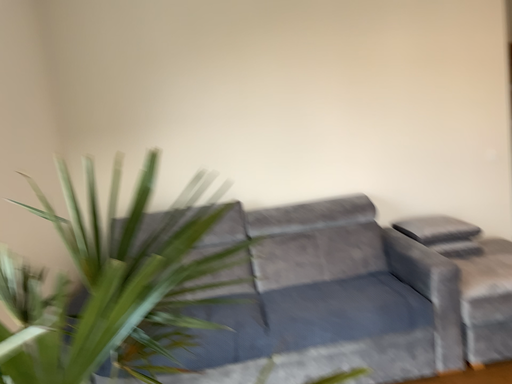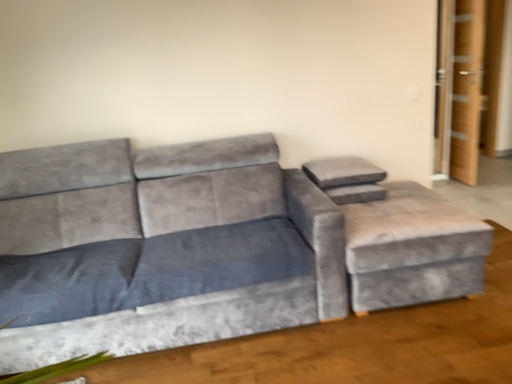
Question: How did the camera likely rotate when shooting the video?

Choices:
 (A) rotated downward
 (B) rotated upward

Answer: (A)